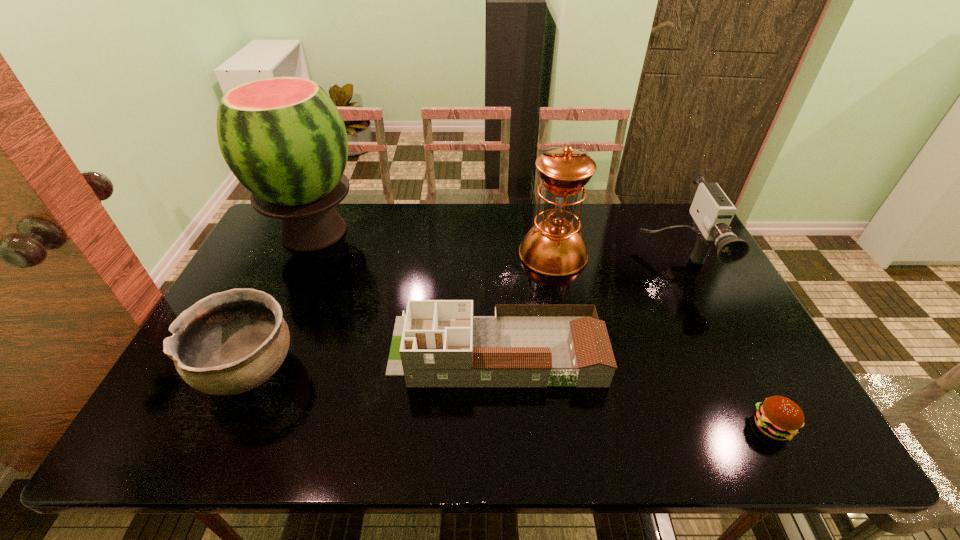
Image resolution: width=960 pixels, height=540 pixels. In order to click on camcorder that is positioned at the right edge in this screenshot , I will do `click(712, 211)`.

At what (x,y) coordinates should I click in order to perform the action: click on hamburger located at the right edge. Please return your answer as a coordinate pair (x, y). The image size is (960, 540). Looking at the image, I should click on (778, 417).

The width and height of the screenshot is (960, 540). In order to click on object at the far left corner in this screenshot , I will do `click(283, 138)`.

Where is `object that is at the far right corner`? object that is at the far right corner is located at coordinates (712, 211).

This screenshot has width=960, height=540. What are the coordinates of `object positioned at the near right corner` in the screenshot? It's located at (778, 417).

In order to click on vacant area at the far edge of the desktop in this screenshot , I will do `click(363, 235)`.

Locate an element on the screen. This screenshot has width=960, height=540. free space at the near edge of the desktop is located at coordinates (668, 447).

The height and width of the screenshot is (540, 960). Find the location of `free region at the left edge of the desktop`. free region at the left edge of the desktop is located at coordinates (262, 284).

Locate an element on the screen. vacant space at the right edge is located at coordinates (725, 323).

The image size is (960, 540). I want to click on vacant space at the near left corner of the desktop, so click(179, 431).